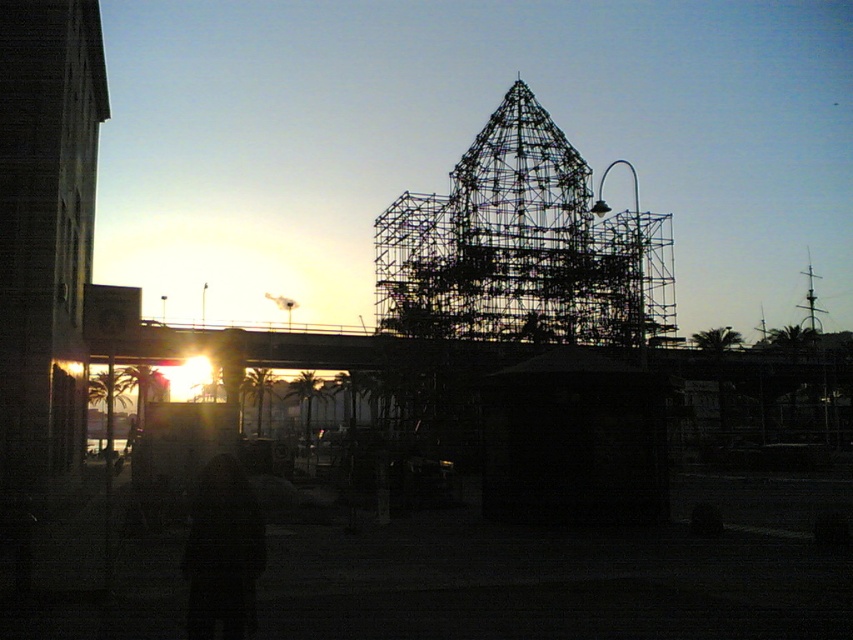
Question: Which point appears closest to the camera in this image?

Choices:
 (A) (187, 608)
 (B) (543, 282)

Answer: (A)

Question: Among these points, which one is farthest from the camera?

Choices:
 (A) (509, 182)
 (B) (209, 634)

Answer: (A)

Question: Does metallic scaffolding at center have a lesser width compared to dark fabric coat at lower center?

Choices:
 (A) no
 (B) yes

Answer: (A)

Question: Does metallic scaffolding at center have a lesser width compared to dark fabric coat at lower center?

Choices:
 (A) no
 (B) yes

Answer: (A)

Question: From the image, what is the correct spatial relationship of metallic scaffolding at center in relation to dark fabric coat at lower center?

Choices:
 (A) left
 (B) right

Answer: (B)

Question: Among these points, which one is farthest from the camera?

Choices:
 (A) (253, 522)
 (B) (376, 253)

Answer: (B)